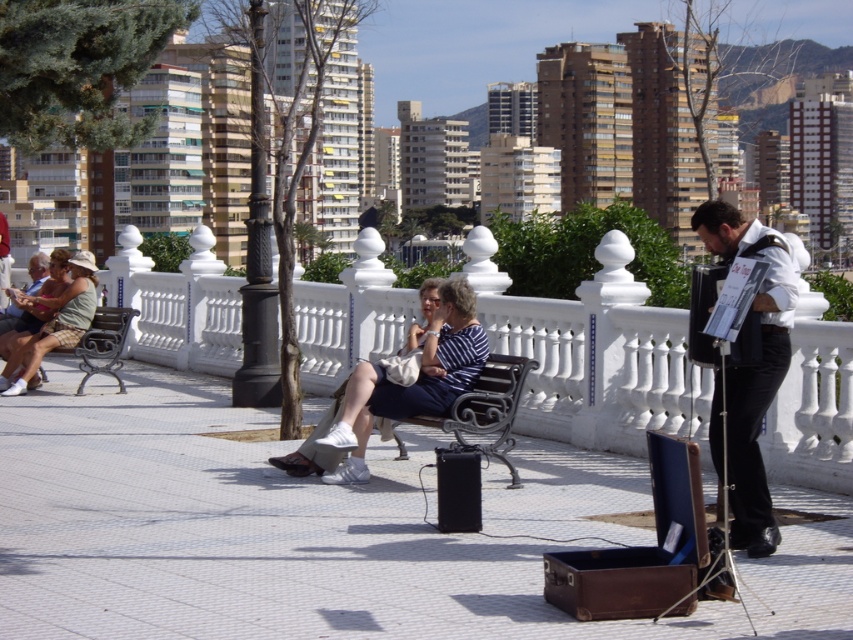
The width and height of the screenshot is (853, 640). Describe the element at coordinates (279, 528) in the screenshot. I see `white tile pavement at center` at that location.

Does point (190, 605) come behind point (64, 316)?

That is False.

Where is `white tile pavement at center`? The image size is (853, 640). white tile pavement at center is located at coordinates (279, 528).

Does white stone fence at center have a greater height compared to matte green dress at left?

Yes, white stone fence at center is taller than matte green dress at left.

Does white stone fence at center appear under matte green dress at left?

No.

The height and width of the screenshot is (640, 853). In order to click on white stone fence at center in this screenshot , I will do `click(595, 355)`.

What are the coordinates of `black velvet suit at right` in the screenshot? It's located at (752, 365).

Measure the distance between point (720, 396) and camera.

They are 30.85 feet apart.

Where is `black velvet suit at right`? Image resolution: width=853 pixels, height=640 pixels. black velvet suit at right is located at coordinates (752, 365).